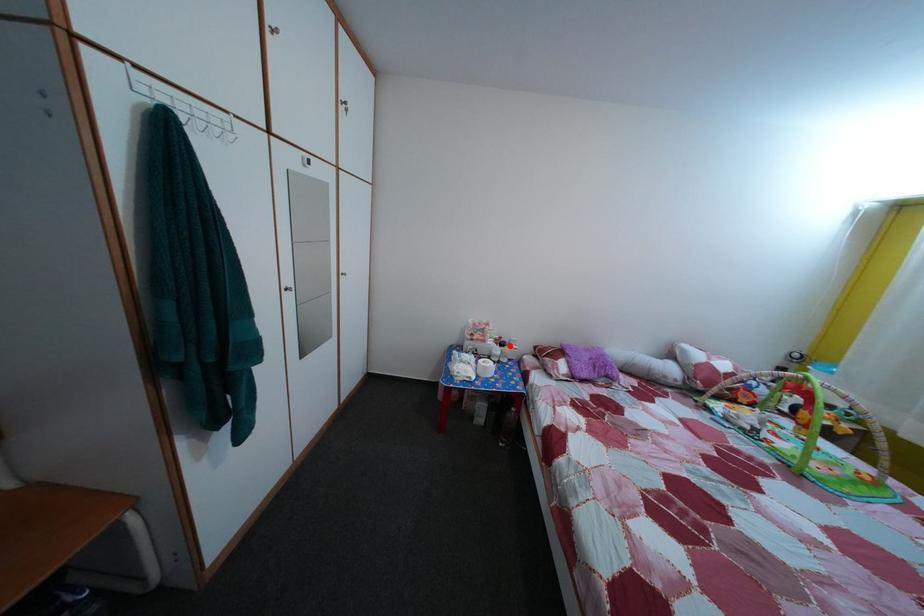
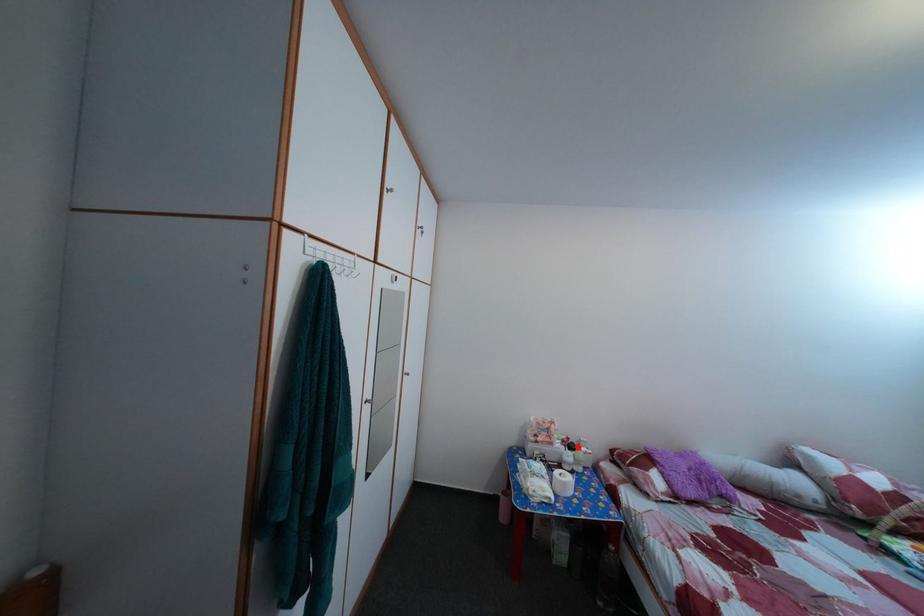
I am providing you with two images of the same scene from different viewpoints. A red point is marked on the first image and another point is marked on the second image. Are the points marked in image1 and image2 representing the same 3D position?

Yes